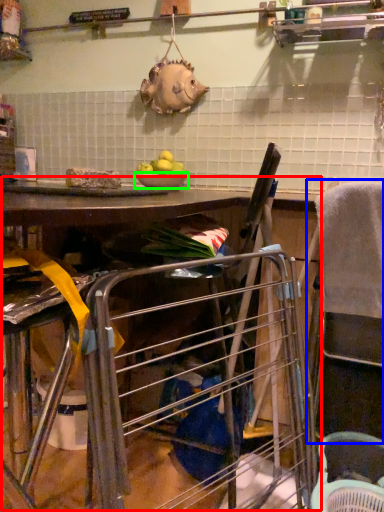
Question: Which object is the farthest from workbench (highlighted by a red box)? Choose among these: feeding chair (highlighted by a blue box) or bowl (highlighted by a green box).

Choices:
 (A) feeding chair
 (B) bowl

Answer: (B)